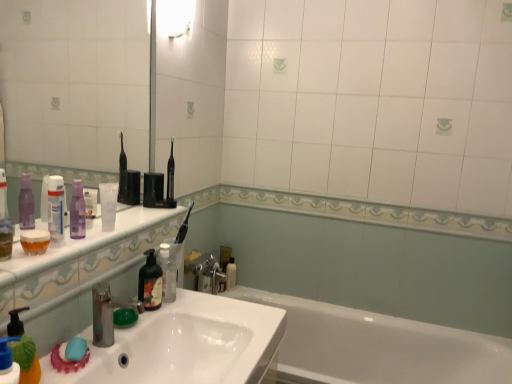
Where is `unoccupied area in front of purple matte bottle at left, the fourth toiletry positioned from the bottom`? Image resolution: width=512 pixels, height=384 pixels. unoccupied area in front of purple matte bottle at left, the fourth toiletry positioned from the bottom is located at coordinates (49, 257).